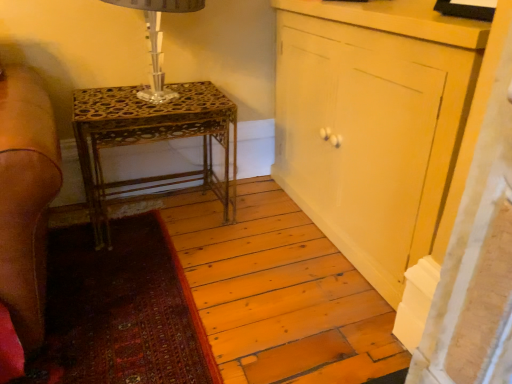
Question: Can you confirm if clear glass table lamp at upper left is positioned to the left of matte yellow cabinet at center?

Choices:
 (A) yes
 (B) no

Answer: (A)

Question: From the image's perspective, is clear glass table lamp at upper left over matte yellow cabinet at center?

Choices:
 (A) yes
 (B) no

Answer: (A)

Question: Is matte yellow cabinet at center completely or partially inside clear glass table lamp at upper left?

Choices:
 (A) no
 (B) yes

Answer: (A)

Question: Does clear glass table lamp at upper left turn towards matte yellow cabinet at center?

Choices:
 (A) no
 (B) yes

Answer: (A)

Question: Considering the relative sizes of clear glass table lamp at upper left and matte yellow cabinet at center in the image provided, is clear glass table lamp at upper left wider than matte yellow cabinet at center?

Choices:
 (A) no
 (B) yes

Answer: (B)

Question: Is clear glass table lamp at upper left inside the boundaries of gold metallic table at center, or outside?

Choices:
 (A) outside
 (B) inside

Answer: (A)

Question: Is clear glass table lamp at upper left wider or thinner than gold metallic table at center?

Choices:
 (A) wide
 (B) thin

Answer: (B)

Question: From the image's perspective, is clear glass table lamp at upper left located above or below gold metallic table at center?

Choices:
 (A) below
 (B) above

Answer: (B)

Question: Considering their positions, is clear glass table lamp at upper left located in front of or behind gold metallic table at center?

Choices:
 (A) behind
 (B) front

Answer: (B)

Question: From their relative heights in the image, would you say matte yellow cabinet at center is taller or shorter than clear glass table lamp at upper left?

Choices:
 (A) tall
 (B) short

Answer: (A)

Question: Would you say matte yellow cabinet at center is to the left or to the right of clear glass table lamp at upper left in the picture?

Choices:
 (A) left
 (B) right

Answer: (B)

Question: From the image's perspective, relative to clear glass table lamp at upper left, is matte yellow cabinet at center above or below?

Choices:
 (A) above
 (B) below

Answer: (B)

Question: Do you think matte yellow cabinet at center is within clear glass table lamp at upper left, or outside of it?

Choices:
 (A) inside
 (B) outside

Answer: (B)

Question: From a real-world perspective, is matte yellow cabinet at center above or below gold metallic table at center?

Choices:
 (A) above
 (B) below

Answer: (A)

Question: Based on their positions, is matte yellow cabinet at center located to the left or right of gold metallic table at center?

Choices:
 (A) left
 (B) right

Answer: (B)